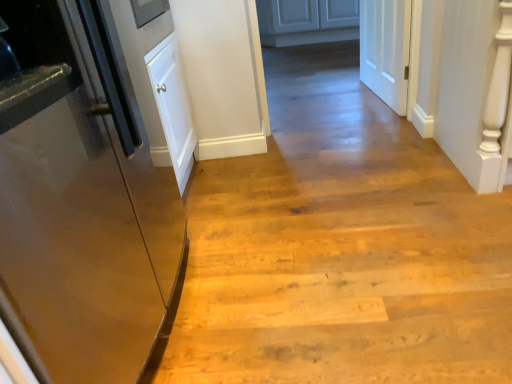
Find the location of `vacant space positioned to the left of white matte door at upper right, which appears as the 1th door when viewed from the back`. vacant space positioned to the left of white matte door at upper right, which appears as the 1th door when viewed from the back is located at coordinates pos(326,102).